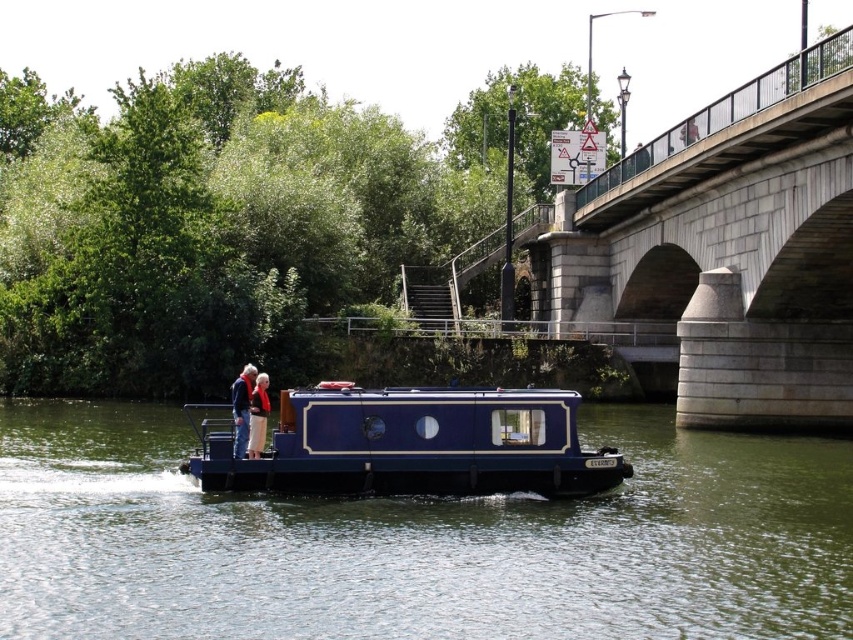
Does blue fabric jacket at center lie in front of light beige pants at center?

No, it is not.

This screenshot has width=853, height=640. I want to click on blue fabric jacket at center, so click(x=242, y=408).

Is blue glossy houseboat at center below blue polished wood houseboat at center?

Yes, blue glossy houseboat at center is below blue polished wood houseboat at center.

Can you confirm if blue glossy houseboat at center is taller than blue polished wood houseboat at center?

Incorrect, blue glossy houseboat at center's height is not larger of blue polished wood houseboat at center's.

Is point (648, 452) closer to viewer compared to point (614, 474)?

No, (648, 452) is further to viewer.

Locate an element on the screen. blue glossy houseboat at center is located at coordinates (419, 541).

Between blue glossy houseboat at center and blue fabric jacket at center, which one has more height?

Standing taller between the two is blue glossy houseboat at center.

Does blue glossy houseboat at center have a lesser width compared to blue fabric jacket at center?

No.

Which is behind, point (804, 499) or point (244, 387)?

Positioned behind is point (804, 499).

Identify the location of blue glossy houseboat at center. The width and height of the screenshot is (853, 640). point(419,541).